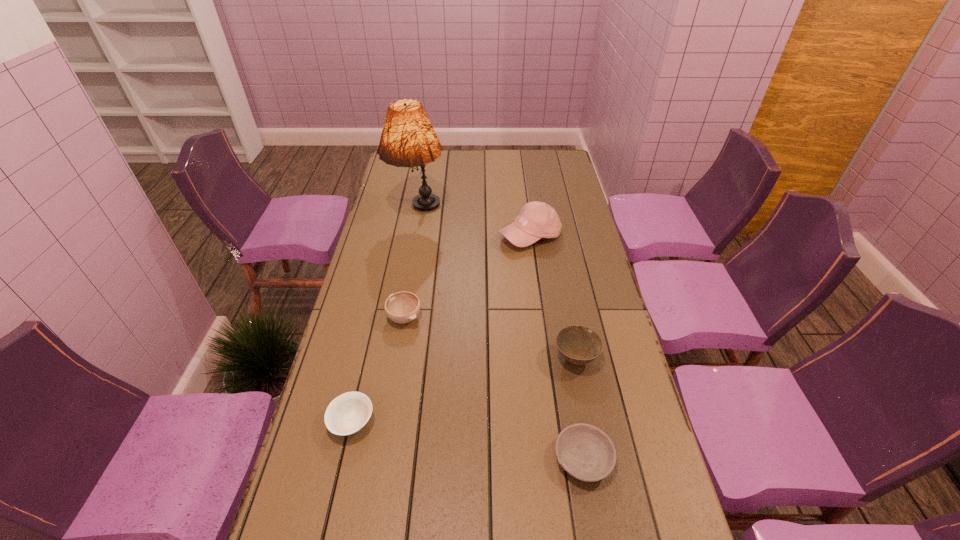
Locate an element on the screen. The height and width of the screenshot is (540, 960). free location located on the left of the fourth tallest object is located at coordinates (349, 318).

I want to click on free space located 0.100m on the left of the shortest bowl, so click(513, 459).

What are the coordinates of `lampshade located at the left edge` in the screenshot? It's located at (408, 139).

Image resolution: width=960 pixels, height=540 pixels. I want to click on baseball cap situated at the right edge, so click(537, 220).

This screenshot has height=540, width=960. I want to click on blank space at the far edge, so click(x=518, y=153).

Where is `free space at the left edge of the desktop`? The image size is (960, 540). free space at the left edge of the desktop is located at coordinates coord(388,283).

This screenshot has height=540, width=960. In the image, there is a desktop. What are the coordinates of `vacant space at the right edge` in the screenshot? It's located at (547, 191).

The height and width of the screenshot is (540, 960). In order to click on vacant space that's between the second tallest object and the shortest bowl in this screenshot , I will do `click(557, 348)`.

You are a GUI agent. You are given a task and a screenshot of the screen. Output one action in this format:
    pyautogui.click(x=<x>, y=<y>)
    Task: Click on the vacant area between the third farthest object and the shortest object
    This screenshot has width=960, height=540.
    Given the screenshot: What is the action you would take?
    pyautogui.click(x=493, y=388)

The height and width of the screenshot is (540, 960). Find the location of `vacant area that lies between the shortest object and the tallest object`. vacant area that lies between the shortest object and the tallest object is located at coordinates (500, 337).